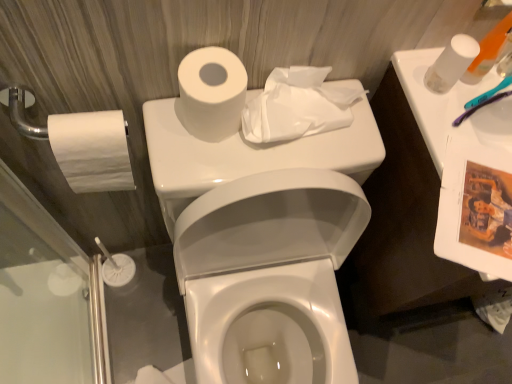
Question: Based on their sizes in the image, would you say white matte toilet paper at upper right, the 4th toilet paper in the left-to-right sequence, is bigger or smaller than translucent plastic toothbrush at upper right, the second toiletry in the left-to-right sequence?

Choices:
 (A) big
 (B) small

Answer: (A)

Question: Looking at their shapes, would you say white matte toilet paper at upper right, positioned as the first toilet paper in right-to-left order, is wider or thinner than translucent plastic toothbrush at upper right, the first toiletry when ordered from right to left?

Choices:
 (A) wide
 (B) thin

Answer: (A)

Question: Which object is positioned farthest from the white glossy toilet at center?

Choices:
 (A) white matte tissue at upper center, the 2th toilet paper when ordered from right to left
 (B) translucent plastic toothbrush at upper right, the second toiletry in the left-to-right sequence
 (C) white matte toilet paper at upper right, positioned as the first toilet paper in right-to-left order
 (D) white matte toilet paper at left, the fourth toilet paper positioned from the right
 (E) white plastic toothbrush at upper right, the 2th toiletry from the right

Answer: (B)

Question: Estimate the real-world distances between objects in this image. Which object is closer to the white matte toilet paper at upper center, which appears as the third toilet paper when viewed from the right?

Choices:
 (A) white plastic toothbrush at upper right, the 2th toiletry from the right
 (B) white matte toilet paper at left, the 1th toilet paper when ordered from left to right
 (C) white glossy toilet at center
 (D) white matte tissue at upper center, the 2th toilet paper when ordered from right to left
 (E) translucent plastic toothbrush at upper right, the second toiletry in the left-to-right sequence

Answer: (D)